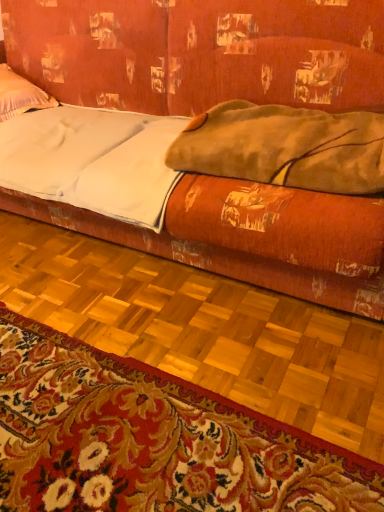
Question: Is fuzzy brown blanket at upper right inside velvet orange couch at center?

Choices:
 (A) no
 (B) yes

Answer: (B)

Question: Is velvet orange couch at center closer to camera compared to fuzzy brown blanket at upper right?

Choices:
 (A) yes
 (B) no

Answer: (A)

Question: Does velvet orange couch at center have a smaller size compared to fuzzy brown blanket at upper right?

Choices:
 (A) yes
 (B) no

Answer: (B)

Question: From a real-world perspective, is velvet orange couch at center under fuzzy brown blanket at upper right?

Choices:
 (A) yes
 (B) no

Answer: (A)

Question: From a real-world perspective, is velvet orange couch at center positioned over fuzzy brown blanket at upper right based on gravity?

Choices:
 (A) no
 (B) yes

Answer: (A)

Question: Does velvet orange couch at center appear on the right side of fuzzy brown blanket at upper right?

Choices:
 (A) no
 (B) yes

Answer: (A)

Question: Are carpeted mat at lower center and white soft pillow at upper left located far from each other?

Choices:
 (A) yes
 (B) no

Answer: (A)

Question: Is carpeted mat at lower center located outside white soft pillow at upper left?

Choices:
 (A) yes
 (B) no

Answer: (A)

Question: Is the position of carpeted mat at lower center less distant than that of white soft pillow at upper left?

Choices:
 (A) no
 (B) yes

Answer: (B)

Question: Is the surface of carpeted mat at lower center in direct contact with white soft pillow at upper left?

Choices:
 (A) yes
 (B) no

Answer: (B)

Question: Is white soft pillow at upper left at the back of carpeted mat at lower center?

Choices:
 (A) no
 (B) yes

Answer: (A)

Question: From the image's perspective, does carpeted mat at lower center appear higher than white soft pillow at upper left?

Choices:
 (A) yes
 (B) no

Answer: (B)

Question: Does white matte sheet at center lie behind white soft pillow at upper left?

Choices:
 (A) yes
 (B) no

Answer: (B)